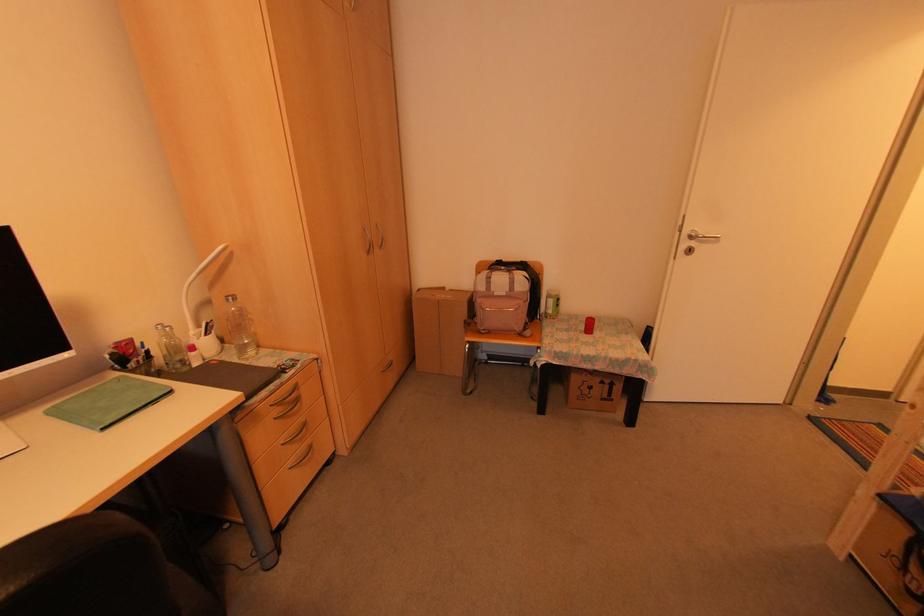
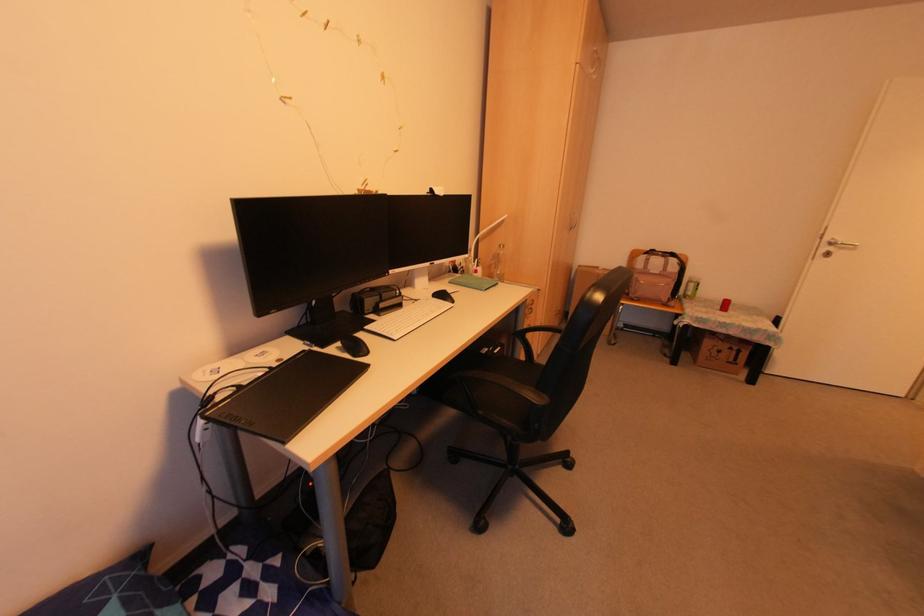
The point at (x=502, y=294) is marked in the first image. Where is the corresponding point in the second image?

(655, 273)